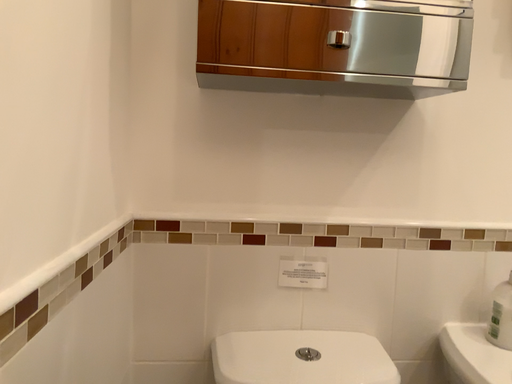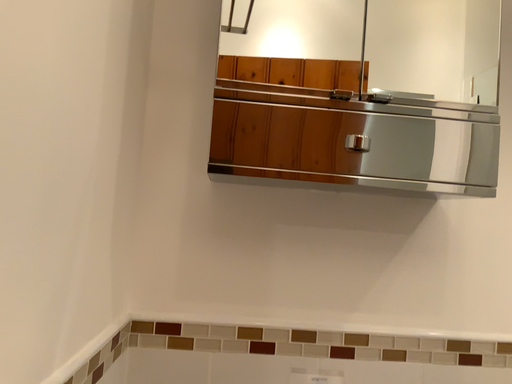
Question: Which way did the camera rotate in the video?

Choices:
 (A) rotated upward
 (B) rotated downward

Answer: (A)